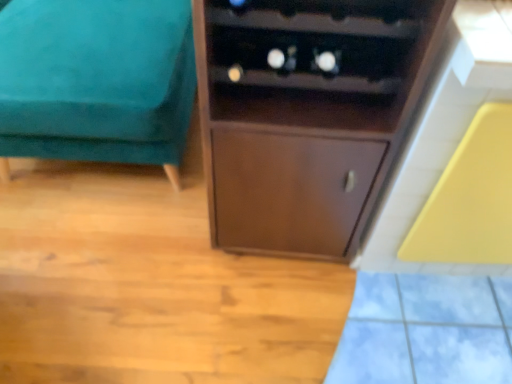
Question: Is point (251, 145) closer or farther from the camera than point (93, 84)?

Choices:
 (A) closer
 (B) farther

Answer: (A)

Question: Visually, is brown wood cupboard at center positioned to the left or to the right of teal velvet ottoman at left?

Choices:
 (A) right
 (B) left

Answer: (A)

Question: In the image, is brown wood cupboard at center positioned in front of or behind teal velvet ottoman at left?

Choices:
 (A) front
 (B) behind

Answer: (A)

Question: Would you say teal velvet ottoman at left is inside or outside brown wood cupboard at center?

Choices:
 (A) outside
 (B) inside

Answer: (A)

Question: Considering the positions of point (129, 117) and point (295, 235), is point (129, 117) closer or farther from the camera than point (295, 235)?

Choices:
 (A) farther
 (B) closer

Answer: (B)

Question: From the image's perspective, is teal velvet ottoman at left above or below brown wood cupboard at center?

Choices:
 (A) below
 (B) above

Answer: (B)

Question: Is teal velvet ottoman at left in front of or behind brown wood cupboard at center in the image?

Choices:
 (A) behind
 (B) front

Answer: (A)